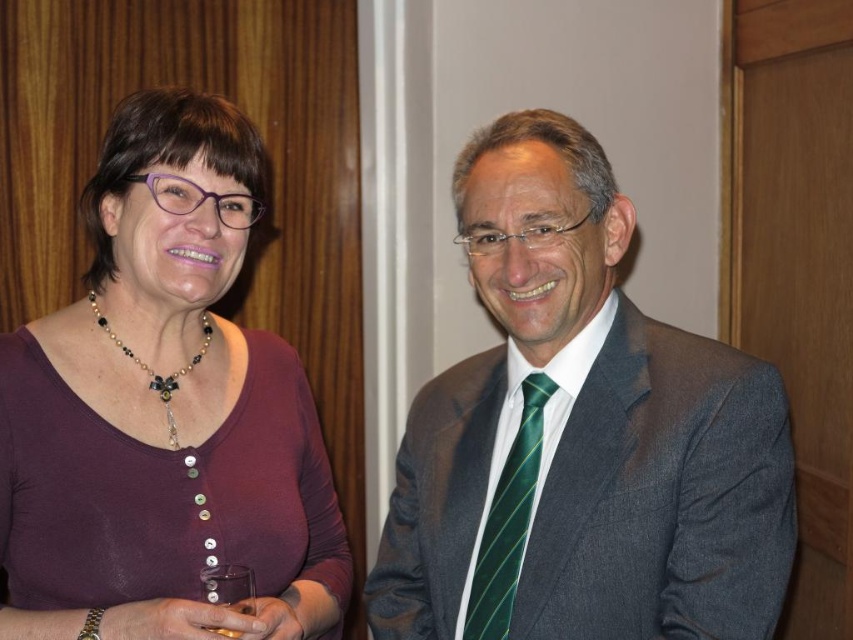
You are organizing a costume party and need to ensure all accessories are visible. Given the green striped tie at center and the pearl and glass beads necklace at upper left, which accessory might be more noticeable to guests from a distance?

The pearl and glass beads necklace at upper left is larger in size compared to the green striped tie at center, so it would be more noticeable from a distance.

You are at a party and want to compliment someone on their outfit. You notice the purple matte shirt at left and the pearl and glass beads necklace at upper left. Which item is located to the right of the other?

The purple matte shirt at left is positioned on the right side of pearl and glass beads necklace at upper left.